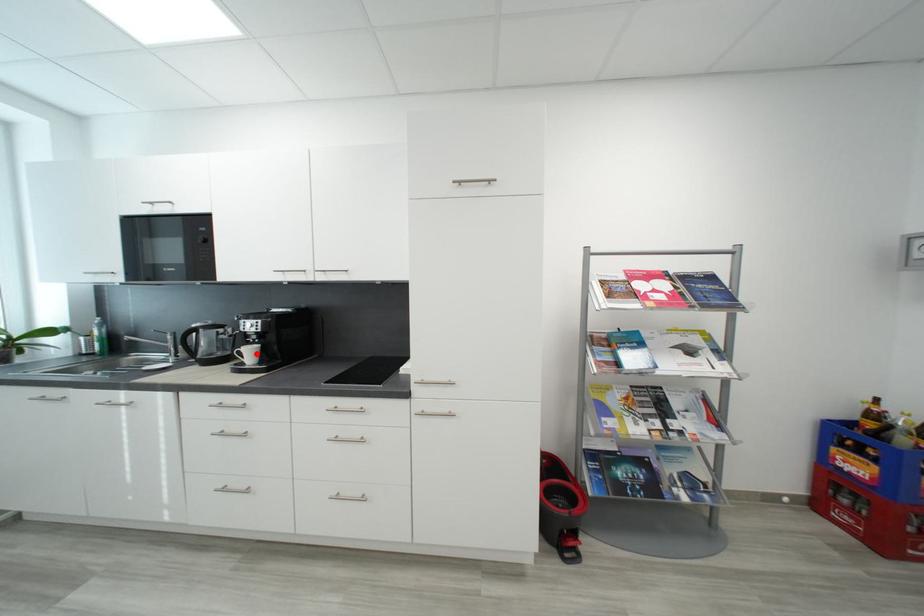
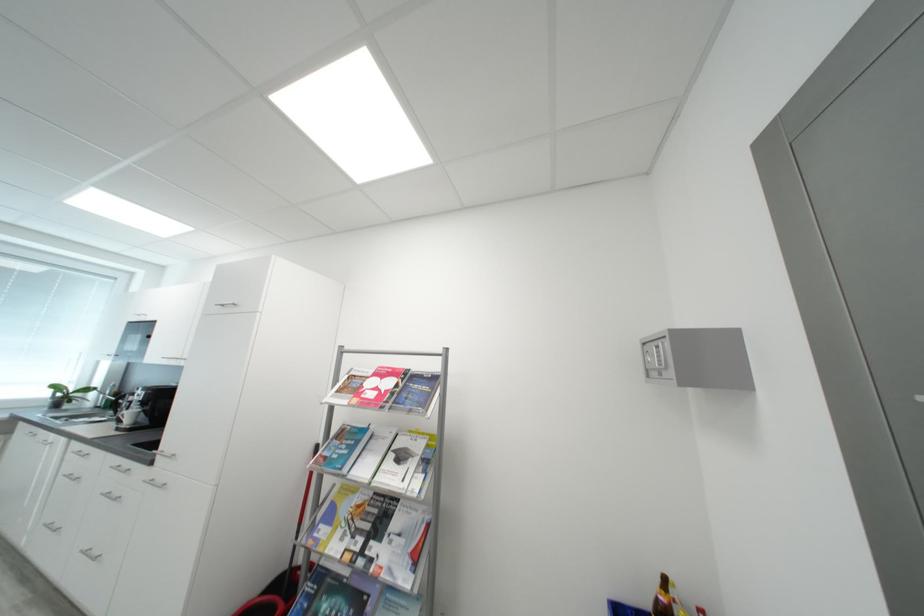
The point at the highlighted location is marked in the first image. Where is the corresponding point in the second image?

(138, 416)